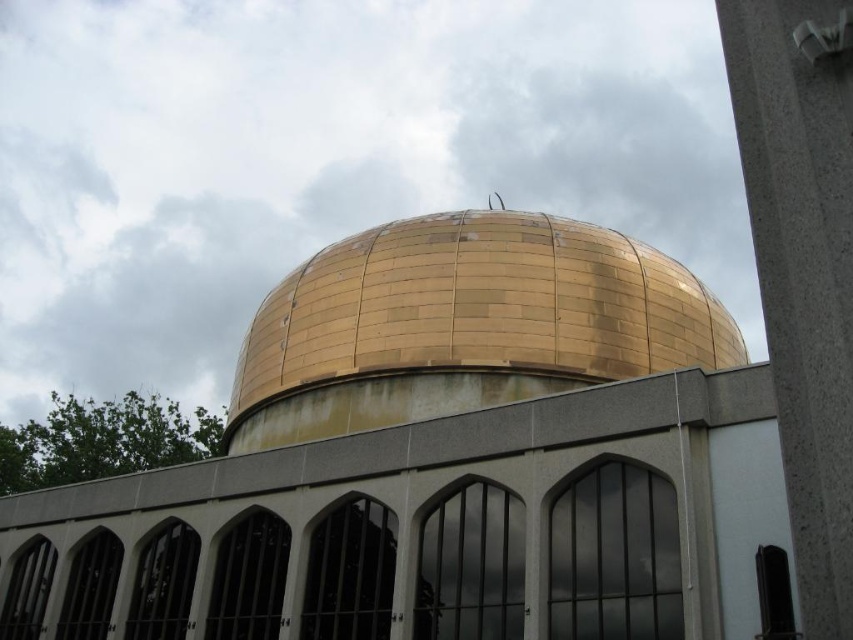
Question: Which of the following is the closest to the observer?

Choices:
 (A) (837, 90)
 (B) (437, 298)

Answer: (A)

Question: Can you confirm if gold metallic dome at center is thinner than gray concrete pillar at right?

Choices:
 (A) yes
 (B) no

Answer: (B)

Question: Does gold metallic dome at center come in front of gray concrete pillar at right?

Choices:
 (A) no
 (B) yes

Answer: (A)

Question: Is gold metallic dome at center smaller than gray concrete pillar at right?

Choices:
 (A) no
 (B) yes

Answer: (A)